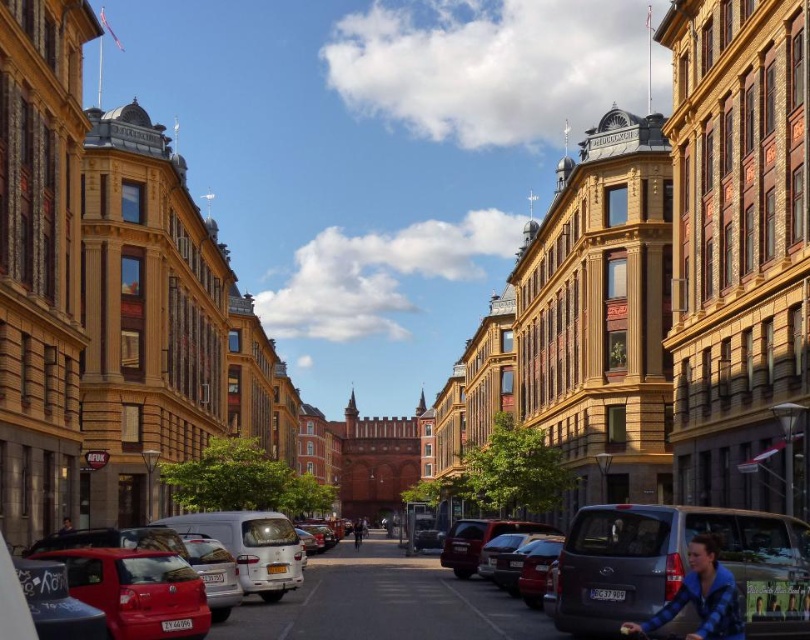
Question: From the image, what is the correct spatial relationship of blue fleece jacket at lower right in relation to dark blue fabric jacket at lower left?

Choices:
 (A) below
 (B) above

Answer: (B)

Question: Does matte red car at lower left have a greater width compared to dark blue fabric jacket at center?

Choices:
 (A) yes
 (B) no

Answer: (A)

Question: Is dark blue fabric jacket at center bigger than dark blue fabric jacket at lower left?

Choices:
 (A) no
 (B) yes

Answer: (B)

Question: Which point is closer to the camera?

Choices:
 (A) matte gray van at lower right
 (B) dark blue fabric jacket at lower left
 (C) blue fleece jacket at lower right
 (D) matte red car at lower left

Answer: (C)

Question: Which is farther from the matte red car at lower left?

Choices:
 (A) dark blue fabric jacket at lower left
 (B) matte gray van at lower right
 (C) blue fleece jacket at lower right
 (D) dark blue fabric jacket at center

Answer: (C)

Question: Which of the following is the closest to the observer?

Choices:
 (A) matte gray van at lower right
 (B) dark blue fabric jacket at lower left
 (C) matte red car at lower left
 (D) blue fleece jacket at lower right

Answer: (D)